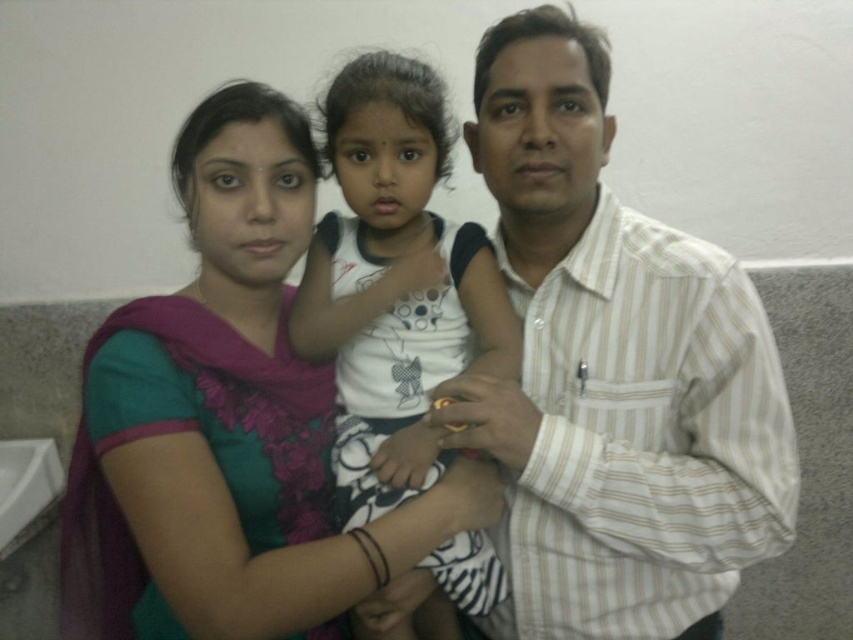
Question: Is green fabric sari at center positioned before white dotted shirt at center?

Choices:
 (A) no
 (B) yes

Answer: (B)

Question: Considering the real-world distances, which object is farthest from the white striped shirt at center?

Choices:
 (A) white dotted shirt at center
 (B) green fabric sari at center

Answer: (B)

Question: Is green fabric sari at center wider than white dotted shirt at center?

Choices:
 (A) no
 (B) yes

Answer: (B)

Question: Based on their relative distances, which object is farther from the white dotted shirt at center?

Choices:
 (A) green fabric sari at center
 (B) white striped shirt at center

Answer: (B)

Question: Is green fabric sari at center above white dotted shirt at center?

Choices:
 (A) yes
 (B) no

Answer: (B)

Question: Estimate the real-world distances between objects in this image. Which object is farther from the white dotted shirt at center?

Choices:
 (A) green fabric sari at center
 (B) white striped shirt at center

Answer: (B)